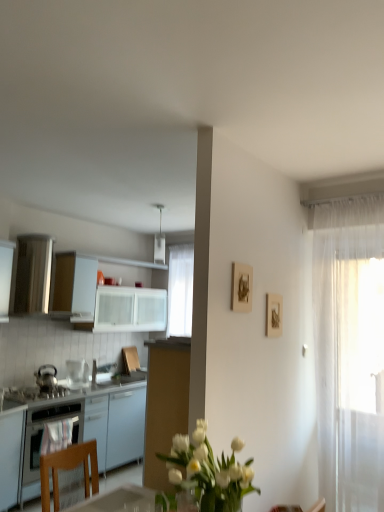
In order to face white plastic light fixture at upper center, should I rotate leftwards or rightwards?

Turn left by 4.048 degrees to look at white plastic light fixture at upper center.

Identify the location of white glossy cabinet at upper left, the second cabinetry in the bottom-to-top sequence. The image size is (384, 512). (106, 297).

At what (x,y) coordinates should I click in order to perform the action: click on sheer white curtain at right. Please return your answer as a coordinate pair (x, y). The image size is (384, 512). Looking at the image, I should click on (349, 351).

Describe the element at coordinates (349, 351) in the screenshot. This screenshot has width=384, height=512. I see `sheer white curtain at right` at that location.

What is the approximate height of satin black stove at lower left?

satin black stove at lower left is 3.77 inches in height.

Where is `white glossy microwave at upper left, positioned as the second kitchen appliance in left-to-right order`? The image size is (384, 512). white glossy microwave at upper left, positioned as the second kitchen appliance in left-to-right order is located at coordinates (78, 370).

The width and height of the screenshot is (384, 512). In order to click on white glossy cabinets at left, positioned as the 1th cabinetry in bottom-to-top order in this screenshot , I will do `click(89, 426)`.

The image size is (384, 512). Identify the location of the 1st kitchen appliance behind the white plastic light fixture at upper center. (46, 378).

From the image's perspective, between shiny metallic kettle at left, acting as the 1th kitchen appliance starting from the left, and white plastic light fixture at upper center, which one is located above?

white plastic light fixture at upper center.

Is shiny metallic kettle at left, acting as the second kitchen appliance starting from the right, turned away from white plastic light fixture at upper center?

No, shiny metallic kettle at left, acting as the second kitchen appliance starting from the right, is not facing away from white plastic light fixture at upper center.

Considering the sizes of shiny metallic kettle at left, acting as the second kitchen appliance starting from the right, and white plastic light fixture at upper center in the image, is shiny metallic kettle at left, acting as the second kitchen appliance starting from the right, wider or thinner than white plastic light fixture at upper center?

shiny metallic kettle at left, acting as the second kitchen appliance starting from the right, is wider than white plastic light fixture at upper center.

Is wooden picture frame at upper center, the 1th picture frame viewed from the right, in contact with white plastic light fixture at upper center?

No.

Is point (273, 302) positioned before point (161, 247)?

Yes, point (273, 302) is closer to viewer.

Would you say wooden picture frame at upper center, which is counted as the 2th picture frame, starting from the front, is inside or outside white plastic light fixture at upper center?

The correct answer is: outside.

Considering the sizes of wooden picture frame at upper center, which is the 1th picture frame in back-to-front order, and white plastic light fixture at upper center in the image, is wooden picture frame at upper center, which is the 1th picture frame in back-to-front order, wider or thinner than white plastic light fixture at upper center?

In the image, wooden picture frame at upper center, which is the 1th picture frame in back-to-front order, appears to be more narrow than white plastic light fixture at upper center.

Is white glossy cabinet at upper left, positioned as the 1th cabinetry in top-to-bottom order, with satin black stove at lower left?

No.

Is white glossy cabinet at upper left, positioned as the 1th cabinetry in top-to-bottom order, positioned with its back to satin black stove at lower left?

No, white glossy cabinet at upper left, positioned as the 1th cabinetry in top-to-bottom order,'s orientation is not away from satin black stove at lower left.

Considering the relative sizes of white glossy cabinet at upper left, the second cabinetry in the bottom-to-top sequence, and satin black stove at lower left in the image provided, is white glossy cabinet at upper left, the second cabinetry in the bottom-to-top sequence, taller than satin black stove at lower left?

Indeed, white glossy cabinet at upper left, the second cabinetry in the bottom-to-top sequence, has a greater height compared to satin black stove at lower left.

Between point (153, 291) and point (60, 386), which one is positioned in front?

The point (60, 386) is in front.

Which object is more forward, white glossy cabinets at left, arranged as the 2th cabinetry when viewed from the top, or satin black stove at lower left?

white glossy cabinets at left, arranged as the 2th cabinetry when viewed from the top, is more forward.

Is white glossy cabinets at left, arranged as the 2th cabinetry when viewed from the top, wider or thinner than satin black stove at lower left?

In the image, white glossy cabinets at left, arranged as the 2th cabinetry when viewed from the top, appears to be wider than satin black stove at lower left.

Is point (133, 440) closer to viewer compared to point (24, 400)?

That is False.

Is white glossy cabinets at left, arranged as the 2th cabinetry when viewed from the top, positioned far away from satin black stove at lower left?

No, white glossy cabinets at left, arranged as the 2th cabinetry when viewed from the top, is not far away from satin black stove at lower left.

Is sheer white curtain at right oriented away from matte wooden picture frame at upper right, the first picture frame in the front-to-back sequence?

sheer white curtain at right is not turned away from matte wooden picture frame at upper right, the first picture frame in the front-to-back sequence.

Which object is further away from the camera taking this photo, sheer white curtain at right or matte wooden picture frame at upper right, positioned as the first picture frame in left-to-right order?

Positioned behind is sheer white curtain at right.

Could you measure the distance between sheer white curtain at right and matte wooden picture frame at upper right, which is the 2th picture frame from right to left?

sheer white curtain at right and matte wooden picture frame at upper right, which is the 2th picture frame from right to left, are 1.06 meters apart.

I want to click on curtain that is under the matte wooden picture frame at upper right, positioned as the first picture frame in left-to-right order (from a real-world perspective), so click(x=349, y=351).

From the image's perspective, does white glossy cabinets at left, positioned as the 1th cabinetry in bottom-to-top order, appear higher than wooden picture frame at upper center, which is counted as the 2th picture frame, starting from the front?

Incorrect, from the image's perspective, white glossy cabinets at left, positioned as the 1th cabinetry in bottom-to-top order, is lower than wooden picture frame at upper center, which is counted as the 2th picture frame, starting from the front.

The height and width of the screenshot is (512, 384). Identify the location of the 1st picture frame positioned above the white glossy cabinets at left, arranged as the 2th cabinetry when viewed from the top (from a real-world perspective). tap(274, 315).

Considering the sizes of objects white glossy microwave at upper left, the first kitchen appliance from the right, and satin black stove at lower left in the image provided, who is smaller, white glossy microwave at upper left, the first kitchen appliance from the right, or satin black stove at lower left?

Smaller between the two is white glossy microwave at upper left, the first kitchen appliance from the right.

From a real-world perspective, is white glossy microwave at upper left, positioned as the second kitchen appliance in left-to-right order, located beneath satin black stove at lower left?

No, from a real-world perspective, white glossy microwave at upper left, positioned as the second kitchen appliance in left-to-right order, is not beneath satin black stove at lower left.

The width and height of the screenshot is (384, 512). Find the location of `appliance above the shiny metallic kettle at left, acting as the second kitchen appliance starting from the right (from the image's perspective)`. appliance above the shiny metallic kettle at left, acting as the second kitchen appliance starting from the right (from the image's perspective) is located at coordinates (159, 241).

This screenshot has height=512, width=384. Find the location of `appliance behind the wooden picture frame at upper center, the second picture frame from the left`. appliance behind the wooden picture frame at upper center, the second picture frame from the left is located at coordinates (159, 241).

Based on the photo, considering their positions, is satin black stove at lower left positioned further to white glossy microwave at upper left, the first kitchen appliance from the right, than white glossy cabinet at upper left, the second cabinetry in the bottom-to-top sequence?

white glossy cabinet at upper left, the second cabinetry in the bottom-to-top sequence, lies further to white glossy microwave at upper left, the first kitchen appliance from the right, than the other object.

Looking at the image, which one is located closer to sheer white curtain at right, white plastic light fixture at upper center or wooden picture frame at upper center, the second picture frame from the left?

wooden picture frame at upper center, the second picture frame from the left, lies closer to sheer white curtain at right than the other object.

Looking at the image, which one is located closer to sheer white curtain at right, white glossy cabinets at left, positioned as the 1th cabinetry in bottom-to-top order, or wooden picture frame at upper center, which is counted as the 2th picture frame, starting from the front?

The object closer to sheer white curtain at right is wooden picture frame at upper center, which is counted as the 2th picture frame, starting from the front.

Considering their positions, is white glossy cabinets at left, arranged as the 2th cabinetry when viewed from the top, positioned further to wooden picture frame at upper center, which is counted as the 2th picture frame, starting from the front, than white glossy microwave at upper left, positioned as the second kitchen appliance in left-to-right order?

white glossy microwave at upper left, positioned as the second kitchen appliance in left-to-right order, lies further to wooden picture frame at upper center, which is counted as the 2th picture frame, starting from the front, than the other object.

From the image, which object appears to be nearer to shiny metallic kettle at left, acting as the 1th kitchen appliance starting from the left, matte wooden picture frame at upper right, the 2th picture frame when ordered from back to front, or white glossy microwave at upper left, the first kitchen appliance from the right?

white glossy microwave at upper left, the first kitchen appliance from the right, lies closer to shiny metallic kettle at left, acting as the 1th kitchen appliance starting from the left, than the other object.

In the scene shown: Looking at the image, which one is located further to white glossy cabinets at left, positioned as the 1th cabinetry in bottom-to-top order, white glossy cabinet at upper left, positioned as the 1th cabinetry in top-to-bottom order, or sheer white curtain at right?

sheer white curtain at right lies further to white glossy cabinets at left, positioned as the 1th cabinetry in bottom-to-top order, than the other object.

Estimate the real-world distances between objects in this image. Which object is further from white plastic light fixture at upper center, shiny metallic kettle at left, acting as the second kitchen appliance starting from the right, or satin black stove at lower left?

satin black stove at lower left.

Which object lies nearer to the anchor point sheer white curtain at right, white glossy cabinets at left, positioned as the 1th cabinetry in bottom-to-top order, or white plastic light fixture at upper center?

white glossy cabinets at left, positioned as the 1th cabinetry in bottom-to-top order, is closer to sheer white curtain at right.

The height and width of the screenshot is (512, 384). In order to click on stove between matte wooden picture frame at upper right, which is the 2th picture frame from right to left, and white glossy microwave at upper left, positioned as the second kitchen appliance in left-to-right order, along the z-axis in this screenshot , I will do `click(38, 393)`.

Where is `appliance between satin black stove at lower left and matte wooden picture frame at upper right, the 2th picture frame when ordered from back to front, in the horizontal direction`? The image size is (384, 512). appliance between satin black stove at lower left and matte wooden picture frame at upper right, the 2th picture frame when ordered from back to front, in the horizontal direction is located at coordinates (159, 241).

Where is `appliance located between wooden picture frame at upper center, the second picture frame from the left, and white glossy cabinet at upper left, the second cabinetry in the bottom-to-top sequence, in the depth direction`? Image resolution: width=384 pixels, height=512 pixels. appliance located between wooden picture frame at upper center, the second picture frame from the left, and white glossy cabinet at upper left, the second cabinetry in the bottom-to-top sequence, in the depth direction is located at coordinates (159, 241).

Where is `cabinetry between white plastic light fixture at upper center and shiny metallic kettle at left, acting as the second kitchen appliance starting from the right, vertically`? cabinetry between white plastic light fixture at upper center and shiny metallic kettle at left, acting as the second kitchen appliance starting from the right, vertically is located at coordinates (106, 297).